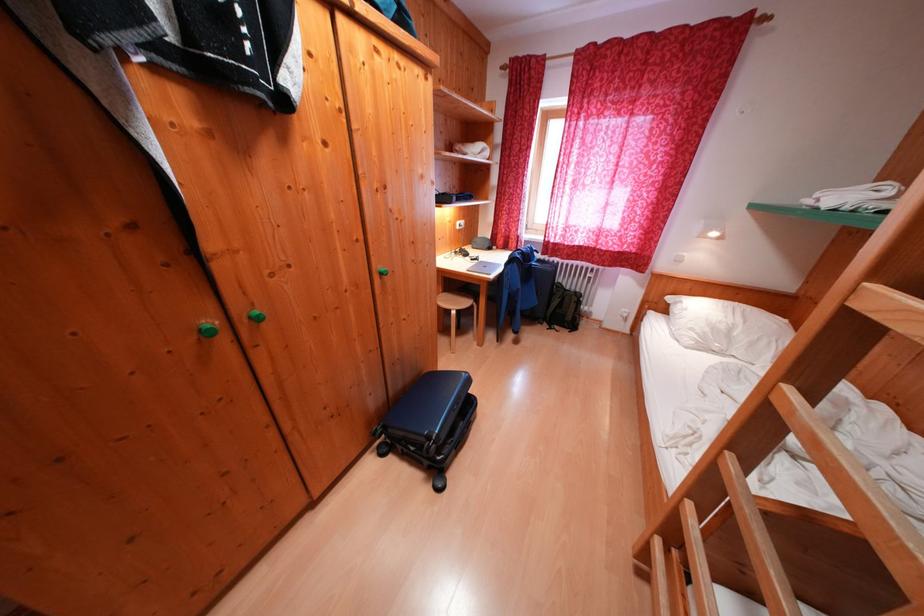
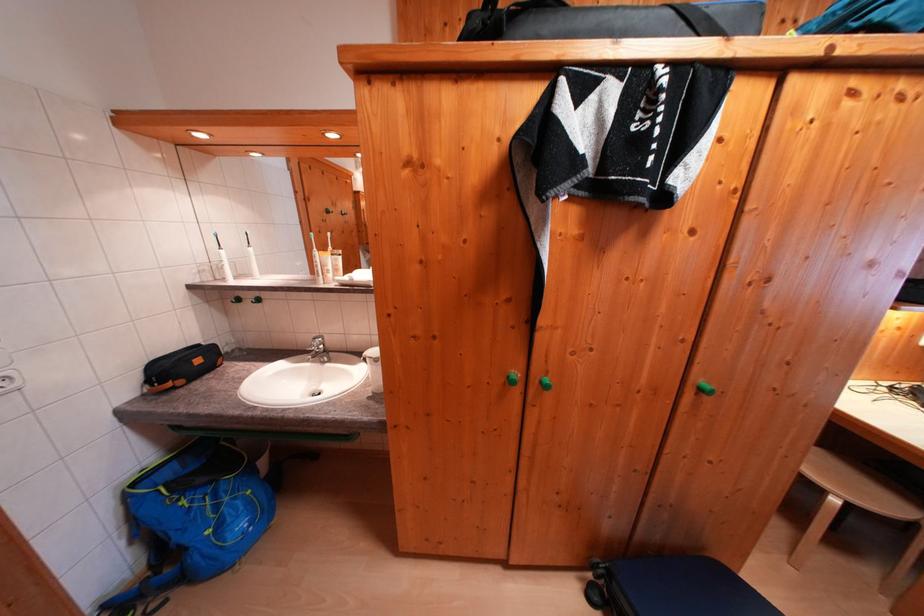
In the second image, find the point that corresponds to point 390,459 in the first image.

(598, 602)